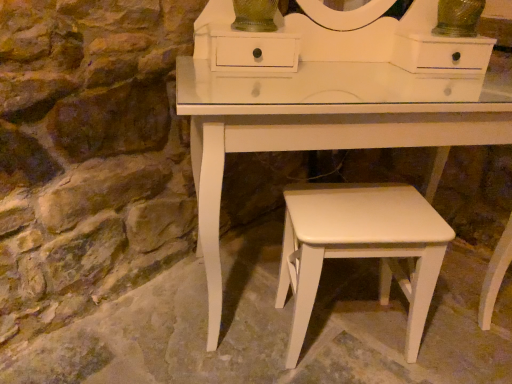
Identify the location of free space to the back side of white matte stool at center. (x=322, y=282).